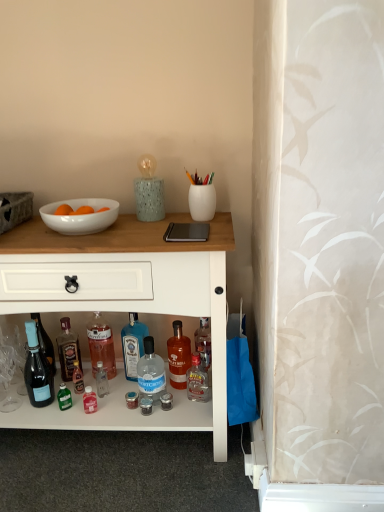
Question: Does white glossy cabinet at center lie in front of white glossy bowl at upper left?

Choices:
 (A) yes
 (B) no

Answer: (A)

Question: Does white glossy cabinet at center turn towards white glossy bowl at upper left?

Choices:
 (A) yes
 (B) no

Answer: (B)

Question: Does white glossy cabinet at center have a lesser width compared to white glossy bowl at upper left?

Choices:
 (A) yes
 (B) no

Answer: (B)

Question: Can you confirm if white glossy cabinet at center is positioned to the left of white glossy bowl at upper left?

Choices:
 (A) no
 (B) yes

Answer: (A)

Question: Is white glossy cabinet at center positioned beyond the bounds of white glossy bowl at upper left?

Choices:
 (A) yes
 (B) no

Answer: (A)

Question: Is white glossy cabinet at center behind white glossy bowl at upper left?

Choices:
 (A) no
 (B) yes

Answer: (A)

Question: From a real-world perspective, is translucent amber glass bottle at center, which is the first bottle in right-to-left order, below white glossy cabinet at center?

Choices:
 (A) yes
 (B) no

Answer: (A)

Question: Does translucent amber glass bottle at center, which is the first bottle in right-to-left order, lie behind white glossy cabinet at center?

Choices:
 (A) no
 (B) yes

Answer: (B)

Question: From the image's perspective, is translucent amber glass bottle at center, which ranks as the fifth bottle in left-to-right order, over white glossy cabinet at center?

Choices:
 (A) yes
 (B) no

Answer: (B)

Question: Considering the relative positions of translucent amber glass bottle at center, which ranks as the fifth bottle in left-to-right order, and white glossy cabinet at center in the image provided, is translucent amber glass bottle at center, which ranks as the fifth bottle in left-to-right order, in front of white glossy cabinet at center?

Choices:
 (A) yes
 (B) no

Answer: (B)

Question: Does translucent amber glass bottle at center, which is the first bottle in right-to-left order, have a larger size compared to white glossy cabinet at center?

Choices:
 (A) yes
 (B) no

Answer: (B)

Question: Could you tell me if translucent amber glass bottle at center, which is the first bottle in right-to-left order, is turned towards white glossy cabinet at center?

Choices:
 (A) no
 (B) yes

Answer: (B)

Question: Can we say clear glass bottle at center, which is the fourth bottle from right to left, lies outside white glossy cabinet at center?

Choices:
 (A) no
 (B) yes

Answer: (A)